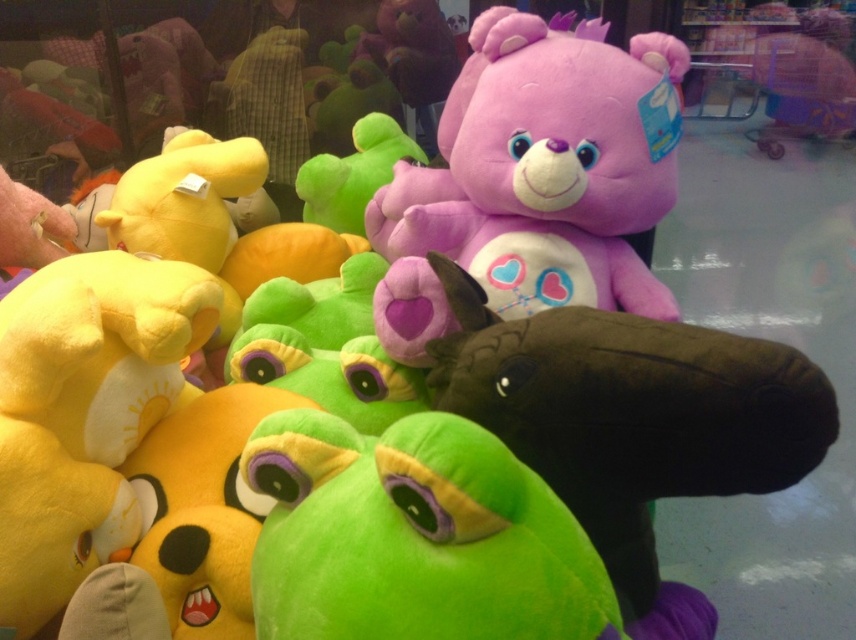
Question: Where is purple plush bear at upper center located in relation to dark brown plush horse at center in the image?

Choices:
 (A) left
 (B) right

Answer: (A)

Question: Among these points, which one is nearest to the camera?

Choices:
 (A) (574, 388)
 (B) (572, 74)

Answer: (A)

Question: Is dark brown plush horse at center positioned before green plush toy at center?

Choices:
 (A) yes
 (B) no

Answer: (B)

Question: Can you confirm if purple plush bear at upper center is thinner than green plush toy at center?

Choices:
 (A) yes
 (B) no

Answer: (B)

Question: Which of the following is the closest to the observer?

Choices:
 (A) (405, 246)
 (B) (340, 509)
 (C) (756, 348)

Answer: (B)

Question: Which point is closer to the camera taking this photo?

Choices:
 (A) (776, 444)
 (B) (296, 502)

Answer: (A)